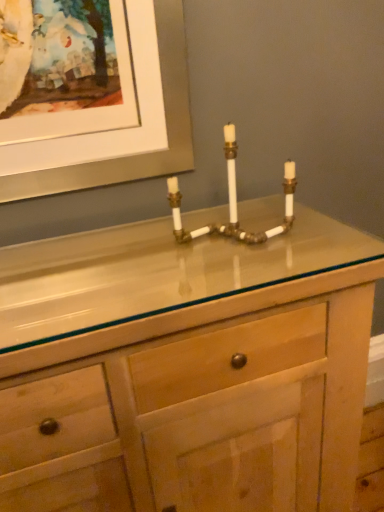
Question: Is point tap(354, 245) positioned closer to the camera than point tap(294, 162)?

Choices:
 (A) farther
 (B) closer

Answer: (B)

Question: Considering their positions, is natural wood cabinet at center located in front of or behind brass/bronze pipe at center?

Choices:
 (A) front
 (B) behind

Answer: (A)

Question: From the image's perspective, relative to brass/bronze pipe at center, is natural wood cabinet at center above or below?

Choices:
 (A) below
 (B) above

Answer: (A)

Question: From the image's perspective, relative to natural wood cabinet at center, is brass/bronze pipe at center above or below?

Choices:
 (A) above
 (B) below

Answer: (A)

Question: From a real-world perspective, is brass/bronze pipe at center physically located above or below natural wood cabinet at center?

Choices:
 (A) below
 (B) above

Answer: (B)

Question: In terms of size, does brass/bronze pipe at center appear bigger or smaller than natural wood cabinet at center?

Choices:
 (A) small
 (B) big

Answer: (A)

Question: Is brass/bronze pipe at center spatially inside natural wood cabinet at center, or outside of it?

Choices:
 (A) inside
 (B) outside

Answer: (B)